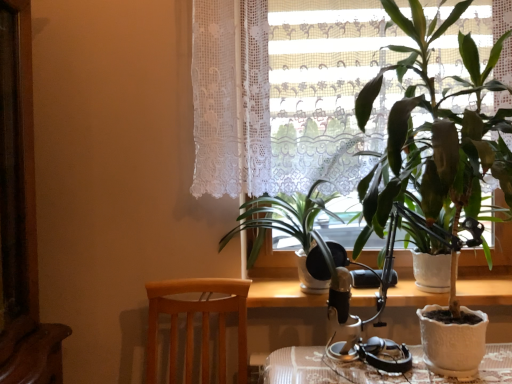
Question: Can we say wooden table at center lies outside white lace curtain at upper center?

Choices:
 (A) no
 (B) yes

Answer: (B)

Question: From a real-world perspective, does wooden table at center sit lower than white lace curtain at upper center?

Choices:
 (A) yes
 (B) no

Answer: (A)

Question: From the image's perspective, is wooden table at center over white lace curtain at upper center?

Choices:
 (A) no
 (B) yes

Answer: (A)

Question: Is wooden table at center positioned with its back to white lace curtain at upper center?

Choices:
 (A) yes
 (B) no

Answer: (B)

Question: Does wooden table at center have a smaller size compared to white lace curtain at upper center?

Choices:
 (A) no
 (B) yes

Answer: (B)

Question: Looking at their shapes, would you say wooden table at center is wider or thinner than green glossy plant at center, marked as the second houseplant in a right-to-left arrangement?

Choices:
 (A) wide
 (B) thin

Answer: (B)

Question: From a real-world perspective, is wooden table at center above or below green glossy plant at center, which is the first houseplant from left to right?

Choices:
 (A) below
 (B) above

Answer: (A)

Question: Relative to green glossy plant at center, which is the first houseplant from left to right, is wooden table at center in front or behind?

Choices:
 (A) behind
 (B) front

Answer: (A)

Question: Is wooden table at center to the left or to the right of green glossy plant at center, marked as the second houseplant in a right-to-left arrangement, in the image?

Choices:
 (A) right
 (B) left

Answer: (A)

Question: Visually, is green glossy plant at center, marked as the second houseplant in a right-to-left arrangement, positioned to the left or to the right of white lace curtain at upper center?

Choices:
 (A) right
 (B) left

Answer: (B)

Question: Would you say green glossy plant at center, which is the first houseplant from left to right, is inside or outside white lace curtain at upper center?

Choices:
 (A) inside
 (B) outside

Answer: (B)

Question: Considering the positions of green glossy plant at center, marked as the second houseplant in a right-to-left arrangement, and white lace curtain at upper center in the image, is green glossy plant at center, marked as the second houseplant in a right-to-left arrangement, taller or shorter than white lace curtain at upper center?

Choices:
 (A) tall
 (B) short

Answer: (B)

Question: From the image's perspective, is green glossy plant at center, marked as the second houseplant in a right-to-left arrangement, positioned above or below white lace curtain at upper center?

Choices:
 (A) above
 (B) below

Answer: (B)

Question: From a real-world perspective, is white lace curtain at upper center above or below green glossy plant at center, marked as the second houseplant in a right-to-left arrangement?

Choices:
 (A) below
 (B) above

Answer: (B)

Question: In terms of height, does white lace curtain at upper center look taller or shorter compared to green glossy plant at center, marked as the second houseplant in a right-to-left arrangement?

Choices:
 (A) tall
 (B) short

Answer: (A)